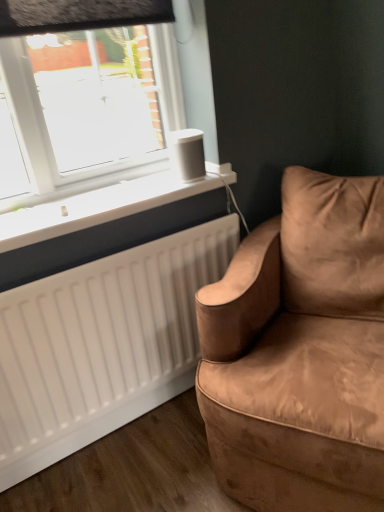
Question: Would you consider white matte radiator at lower left to be distant from suede brown couch at right?

Choices:
 (A) no
 (B) yes

Answer: (A)

Question: Can you confirm if white matte radiator at lower left is bigger than suede brown couch at right?

Choices:
 (A) yes
 (B) no

Answer: (B)

Question: Is white matte radiator at lower left shorter than suede brown couch at right?

Choices:
 (A) yes
 (B) no

Answer: (A)

Question: Does white matte radiator at lower left have a greater height compared to suede brown couch at right?

Choices:
 (A) no
 (B) yes

Answer: (A)

Question: Is suede brown couch at right at the back of white matte radiator at lower left?

Choices:
 (A) yes
 (B) no

Answer: (B)

Question: Does white matte radiator at lower left appear on the right side of suede brown couch at right?

Choices:
 (A) no
 (B) yes

Answer: (A)

Question: Considering the relative positions of suede brown couch at right and white matte radiator at lower left in the image provided, is suede brown couch at right to the left of white matte radiator at lower left from the viewer's perspective?

Choices:
 (A) yes
 (B) no

Answer: (B)

Question: Would you say white matte radiator at lower left is part of suede brown couch at right's contents?

Choices:
 (A) no
 (B) yes

Answer: (A)

Question: Can you confirm if suede brown couch at right is taller than white matte radiator at lower left?

Choices:
 (A) no
 (B) yes

Answer: (B)

Question: Is suede brown couch at right oriented away from white matte radiator at lower left?

Choices:
 (A) yes
 (B) no

Answer: (B)

Question: Is suede brown couch at right far away from white matte radiator at lower left?

Choices:
 (A) yes
 (B) no

Answer: (B)

Question: Is suede brown couch at right not within white matte radiator at lower left?

Choices:
 (A) no
 (B) yes

Answer: (B)

Question: Is suede brown couch at right positioned far away from white matte speaker at upper center?

Choices:
 (A) no
 (B) yes

Answer: (A)